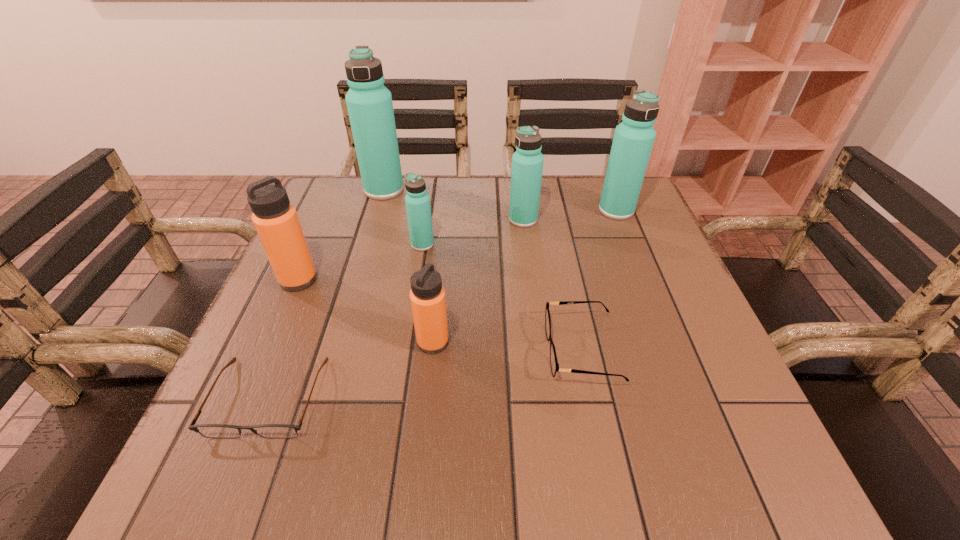
Locate an element on the screen. This screenshot has height=540, width=960. the tallest object is located at coordinates (369, 103).

Locate an element on the screen. The height and width of the screenshot is (540, 960). the fifth thermos bottle from right to left is located at coordinates (369, 103).

Identify the location of the rightmost thermos bottle. The height and width of the screenshot is (540, 960). (633, 140).

Find the location of a particular element. Image resolution: width=960 pixels, height=540 pixels. the third smallest aqua thermos bottle is located at coordinates (633, 140).

I want to click on the third aqua thermos bottle from left to right, so click(527, 162).

Locate an element on the screen. Image resolution: width=960 pixels, height=540 pixels. the second smallest aqua thermos bottle is located at coordinates (527, 162).

At what (x,y) coordinates should I click in order to perform the action: click on the fourth nearest object. Please return your answer as a coordinate pair (x, y). This screenshot has width=960, height=540. Looking at the image, I should click on (275, 219).

Image resolution: width=960 pixels, height=540 pixels. Find the location of `the bigger orange thermos bottle`. the bigger orange thermos bottle is located at coordinates (275, 219).

Find the location of `the nearest aqua thermos bottle`. the nearest aqua thermos bottle is located at coordinates (418, 207).

Where is `the fourth farthest thermos bottle`? The width and height of the screenshot is (960, 540). the fourth farthest thermos bottle is located at coordinates (418, 207).